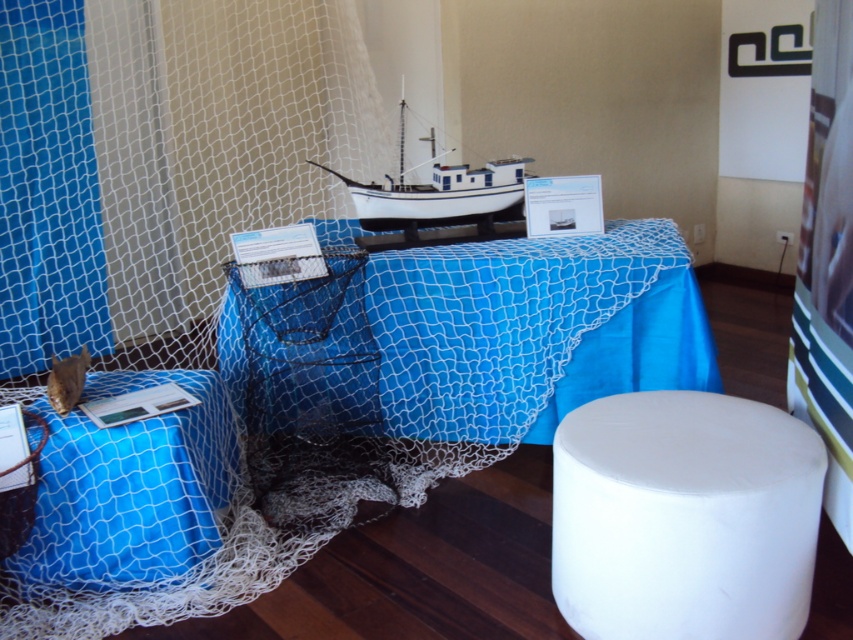
Is blue satin tablecloth at center below white matte boat at center?

Yes.

Measure the distance from blue satin tablecloth at center to white matte boat at center.

blue satin tablecloth at center is 39.41 centimeters away from white matte boat at center.

The width and height of the screenshot is (853, 640). In order to click on blue satin tablecloth at center in this screenshot , I will do `click(529, 326)`.

This screenshot has height=640, width=853. What do you see at coordinates (683, 516) in the screenshot?
I see `white matte stool at lower right` at bounding box center [683, 516].

Can you confirm if white matte stool at lower right is wider than blue satin tablecloth at center?

In fact, white matte stool at lower right might be narrower than blue satin tablecloth at center.

Image resolution: width=853 pixels, height=640 pixels. What are the coordinates of `white matte stool at lower right` in the screenshot? It's located at (683, 516).

Who is taller, blue netting tablecloth at center or white matte stool at lower right?

blue netting tablecloth at center is taller.

Where is `blue netting tablecloth at center`? blue netting tablecloth at center is located at coordinates (343, 413).

Is point (173, 422) closer to viewer compared to point (648, 417)?

No, (173, 422) is further to viewer.

This screenshot has width=853, height=640. What are the coordinates of `blue netting tablecloth at center` in the screenshot? It's located at (343, 413).